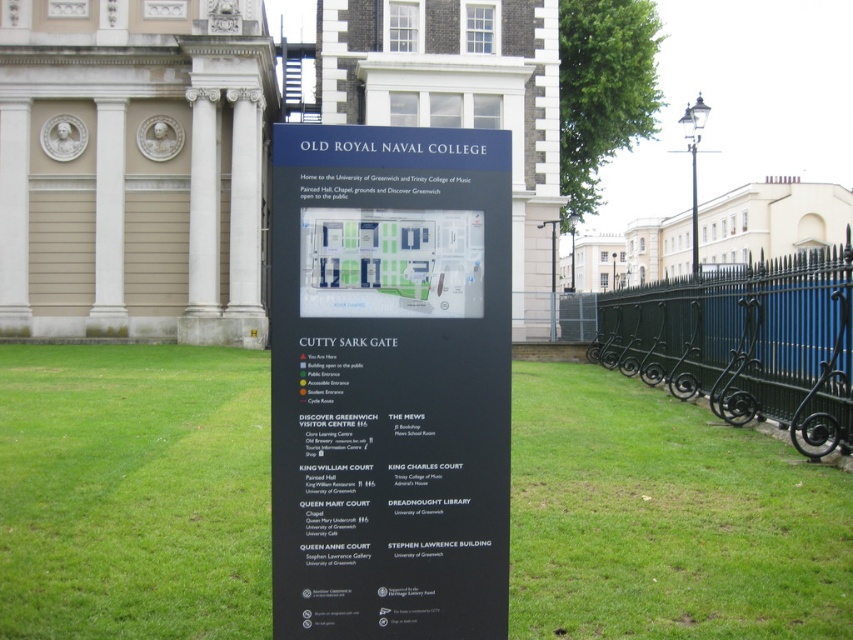
Question: Considering the real-world distances, which object is farthest from the green wrought iron fence at right?

Choices:
 (A) green grass at center
 (B) black matte sign at center

Answer: (B)

Question: Can you confirm if black matte sign at center is positioned below green wrought iron fence at right?

Choices:
 (A) no
 (B) yes

Answer: (B)

Question: Estimate the real-world distances between objects in this image. Which object is farther from the green grass at center?

Choices:
 (A) green wrought iron fence at right
 (B) black matte sign at center

Answer: (A)

Question: Is green grass at center to the left of green wrought iron fence at right from the viewer's perspective?

Choices:
 (A) yes
 (B) no

Answer: (A)

Question: Based on their relative distances, which object is farther from the black matte sign at center?

Choices:
 (A) green wrought iron fence at right
 (B) green grass at center

Answer: (A)

Question: From the image, what is the correct spatial relationship of black matte sign at center in relation to green wrought iron fence at right?

Choices:
 (A) right
 (B) left

Answer: (B)